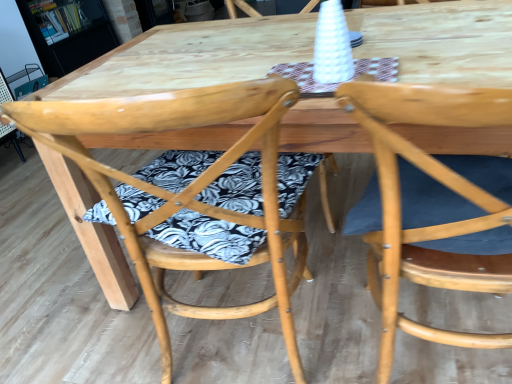
Question: From the image's perspective, is natural wood chair at right, marked as the second chair in a left-to-right arrangement, located above or below natural wood chair at center, the 2th chair viewed from the right?

Choices:
 (A) below
 (B) above

Answer: (A)

Question: Is natural wood chair at right, acting as the first chair starting from the right, situated inside natural wood chair at center, the 2th chair viewed from the right, or outside?

Choices:
 (A) inside
 (B) outside

Answer: (B)

Question: Estimate the real-world distances between objects in this image. Which object is closer to the natural wood chair at center, placed as the first chair when sorted from left to right?

Choices:
 (A) natural wood chair at right, marked as the second chair in a left-to-right arrangement
 (B) wooden bookshelf at upper left

Answer: (A)

Question: Considering the real-world distances, which object is farthest from the natural wood chair at right, acting as the first chair starting from the right?

Choices:
 (A) natural wood chair at center, placed as the first chair when sorted from left to right
 (B) wooden bookshelf at upper left

Answer: (B)